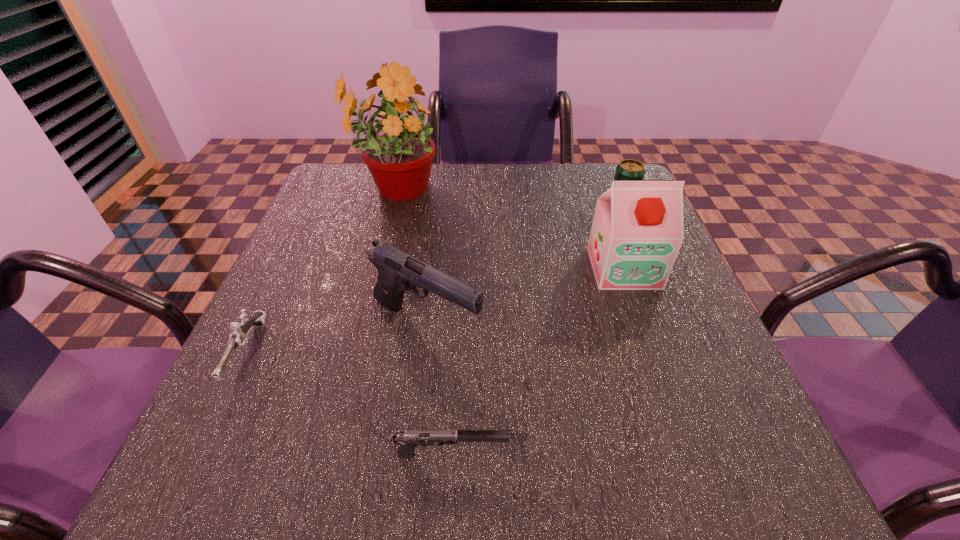
The image size is (960, 540). In order to click on object present at the far left corner in this screenshot , I will do `click(399, 154)`.

This screenshot has width=960, height=540. Identify the location of object present at the far right corner. (628, 169).

This screenshot has height=540, width=960. Find the location of `vacant space at the far edge of the desktop`. vacant space at the far edge of the desktop is located at coordinates (483, 180).

I want to click on free space at the near edge, so click(x=564, y=443).

Find the location of a particular element. vacant point at the left edge is located at coordinates (324, 248).

You are a GUI agent. You are given a task and a screenshot of the screen. Output one action in this format:
    pyautogui.click(x=<x>, y=<y>)
    Task: Click on the free space at the right edge of the desktop
    
    Given the screenshot: What is the action you would take?
    pyautogui.click(x=639, y=318)

This screenshot has width=960, height=540. Identify the location of free space at the far left corner of the desktop. (352, 175).

I want to click on free region at the far right corner, so click(585, 184).

At what (x,y) coordinates should I click in order to perform the action: click on vacant space at the near right corner of the desktop. Please return your answer as a coordinate pair (x, y). Looking at the image, I should click on (739, 462).

At what (x,y) coordinates should I click in order to perform the action: click on unoccupied area between the nearest object and the beer can. Please return your answer as a coordinate pair (x, y). Looking at the image, I should click on (537, 328).